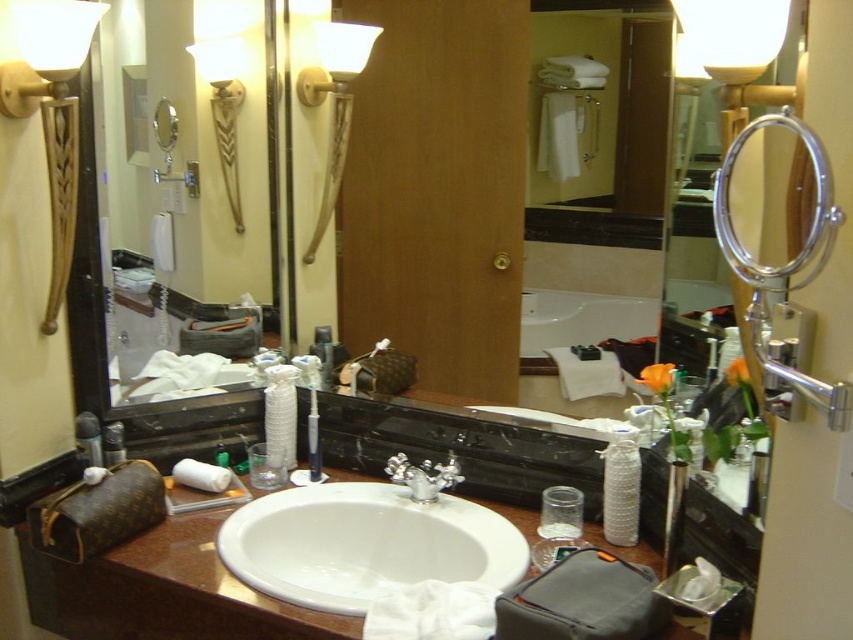
You are standing in the bathroom and want to check your reflection in the matte black mirror at center. Where should you stand to see your reflection clearly?

To see your reflection clearly in the matte black mirror at center, you should stand directly in front of it at point (387, 184).

You are standing in the bathroom and want to pick up an item from the counter. You notice two points marked on the counter at coordinates point (96, 163) and point (102, 442). Which point is closer to you?

Point (96, 163) is closer to the camera than point (102, 442), so the point at coordinates point (96, 163) is closer to you.